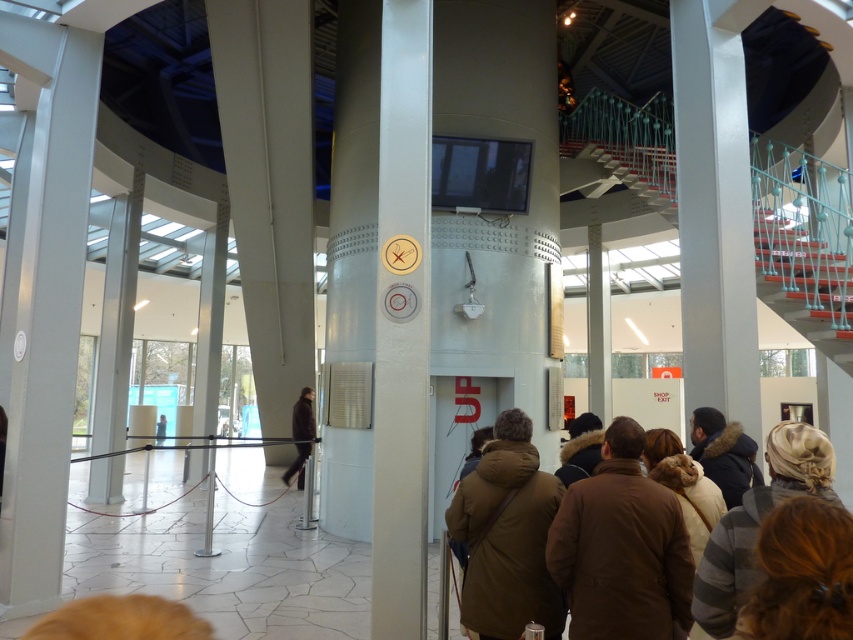
Is brown woolen coat at center to the right of dark brown leather coat at center from the viewer's perspective?

Yes, brown woolen coat at center is to the right of dark brown leather coat at center.

Who is more forward, (732, 561) or (283, 474)?

Point (732, 561) is in front.

I want to click on brown woolen coat at center, so click(x=758, y=522).

Does white glossy pillar at center appear on the left side of brown fuzzy hair at lower right?

Indeed, white glossy pillar at center is positioned on the left side of brown fuzzy hair at lower right.

Which is behind, point (393, 385) or point (761, 586)?

The point (393, 385) is behind.

The height and width of the screenshot is (640, 853). I want to click on white glossy pillar at center, so click(x=402, y=323).

Between dark blue fur-lined coat at lower right and dark brown leather coat at center, which one is positioned lower?

dark brown leather coat at center is below.

Does dark blue fur-lined coat at lower right appear on the left side of dark brown leather coat at center?

In fact, dark blue fur-lined coat at lower right is to the right of dark brown leather coat at center.

Is point (724, 484) less distant than point (299, 426)?

Yes.

Identify the location of dark blue fur-lined coat at lower right. (724, 452).